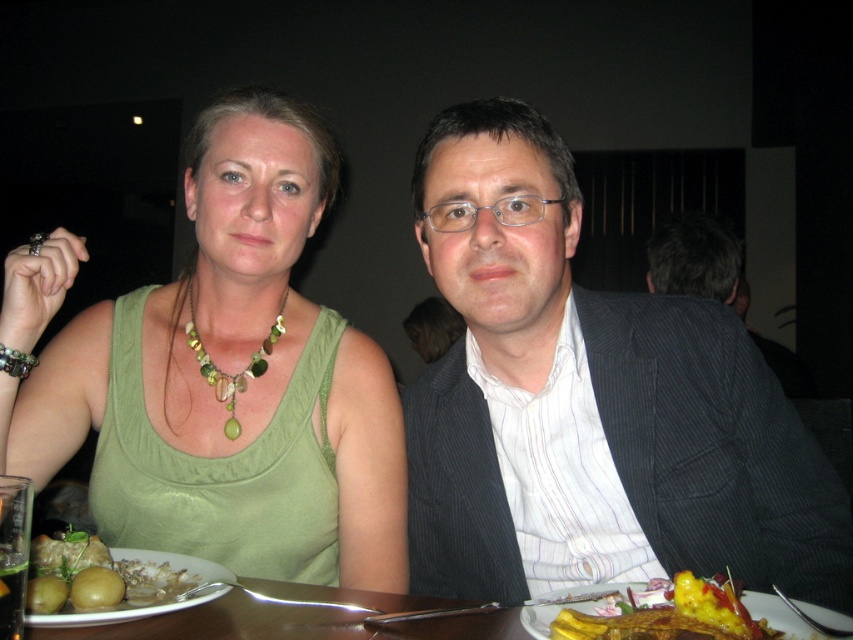
You are a waiter at this restaurant and need to place a new dish on the table between the dark gray pinstripe suit at center and the green matte potatoes at lower left. Where should you place it to ensure it is between them?

The dark gray pinstripe suit at center is located above the green matte potatoes at lower left, so you should place the new dish between them by positioning it below the dark gray pinstripe suit at center and above the green matte potatoes at lower left.

You are a waiter in a restaurant and need to place a new dish on the table. The table has the dark gray pinstripe suit at center. Where should you place the dish to avoid covering the suit?

The dark gray pinstripe suit at center is located at point [630,364], so you should place the dish in an area of the table not overlapping with that coordinate to avoid covering the suit.

You are a waiter in a restaurant and want to place a new order for the customer. The customer points to the yellow glazed pastry at lower right and the green glass beads at center. Which item should you prioritize placing closer to the customer?

The yellow glazed pastry at lower right is in front of the green glass beads at center, so you should prioritize placing the yellow glazed pastry at lower right closer to the customer since it is already positioned nearer to them.